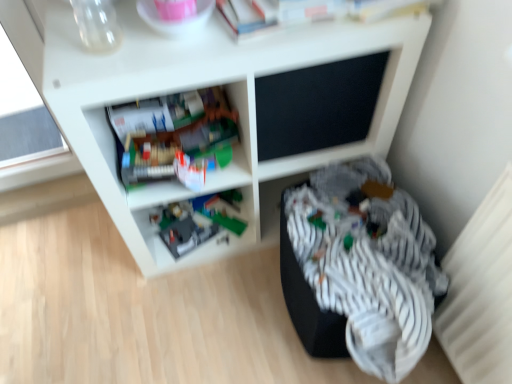
The height and width of the screenshot is (384, 512). What do you see at coordinates (367, 264) in the screenshot?
I see `striped fabric at lower right` at bounding box center [367, 264].

Find the location of a particular element. The image size is (512, 384). plastic gray toy at lower center, the 2th shelf from the front is located at coordinates (199, 226).

From a real-world perspective, is striped fabric at lower right above or below white matte shelf at center, which appears as the second shelf when viewed from the back?

striped fabric at lower right is below white matte shelf at center, which appears as the second shelf when viewed from the back.

Is striped fabric at lower right spatially inside white matte shelf at center, which appears as the second shelf when viewed from the back, or outside of it?

striped fabric at lower right is located beyond the bounds of white matte shelf at center, which appears as the second shelf when viewed from the back.

Is striped fabric at lower right positioned far away from white matte shelf at center, arranged as the 1th shelf when viewed from the front?

That's not correct — striped fabric at lower right is a little close to white matte shelf at center, arranged as the 1th shelf when viewed from the front.

Considering the relative sizes of striped fabric at lower right and white matte shelf at center, which appears as the second shelf when viewed from the back, in the image provided, is striped fabric at lower right wider than white matte shelf at center, which appears as the second shelf when viewed from the back,?

Indeed, striped fabric at lower right has a greater width compared to white matte shelf at center, which appears as the second shelf when viewed from the back.

Does point (398, 34) come in front of point (200, 219)?

Yes.

Could you tell me if white matte shelf at center, arranged as the 1th shelf when viewed from the front, is turned towards plastic gray toy at lower center, the 2th shelf from the front?

No.

How many degrees apart are the facing directions of white matte shelf at center, arranged as the 1th shelf when viewed from the front, and plastic gray toy at lower center, the 2th shelf from the front?

21.5 degrees.

Would you consider white matte shelf at center, arranged as the 1th shelf when viewed from the front, to be distant from plastic gray toy at lower center, positioned as the first shelf in back-to-front order?

No, there isn't a large distance between white matte shelf at center, arranged as the 1th shelf when viewed from the front, and plastic gray toy at lower center, positioned as the first shelf in back-to-front order.

Considering the sizes of striped fabric at lower right and plastic gray toy at lower center, positioned as the first shelf in back-to-front order, in the image, is striped fabric at lower right wider or thinner than plastic gray toy at lower center, positioned as the first shelf in back-to-front order,?

striped fabric at lower right is wider than plastic gray toy at lower center, positioned as the first shelf in back-to-front order.

Can we say striped fabric at lower right lies outside plastic gray toy at lower center, positioned as the first shelf in back-to-front order?

Yes, striped fabric at lower right is not within plastic gray toy at lower center, positioned as the first shelf in back-to-front order.

From a real-world perspective, between striped fabric at lower right and plastic gray toy at lower center, positioned as the first shelf in back-to-front order, who is vertically lower?

plastic gray toy at lower center, positioned as the first shelf in back-to-front order, is physically lower.

From a real-world perspective, is plastic gray toy at lower center, the 2th shelf from the front, on white matte shelf at center, arranged as the 1th shelf when viewed from the front?

No, from a real-world perspective, plastic gray toy at lower center, the 2th shelf from the front, is not above white matte shelf at center, arranged as the 1th shelf when viewed from the front.

From the image's perspective, does plastic gray toy at lower center, positioned as the first shelf in back-to-front order, appear higher than white matte shelf at center, which appears as the second shelf when viewed from the back?

Incorrect, from the image's perspective, plastic gray toy at lower center, positioned as the first shelf in back-to-front order, is lower than white matte shelf at center, which appears as the second shelf when viewed from the back.

Does point (210, 214) lie behind point (393, 40)?

That is True.

Find the location of `clothing that is below the plastic gray toy at lower center, positioned as the first shelf in back-to-front order (from the image's perspective)`. clothing that is below the plastic gray toy at lower center, positioned as the first shelf in back-to-front order (from the image's perspective) is located at coordinates (367, 264).

Does point (223, 200) come behind point (392, 353)?

Yes.

Is plastic gray toy at lower center, positioned as the first shelf in back-to-front order, next to striped fabric at lower right and touching it?

No, plastic gray toy at lower center, positioned as the first shelf in back-to-front order, is not making contact with striped fabric at lower right.

Consider the image. Are white matte shelf at center, which appears as the second shelf when viewed from the back, and striped fabric at lower right located far from each other?

That's not correct — white matte shelf at center, which appears as the second shelf when viewed from the back, is a little close to striped fabric at lower right.

From the picture: From a real-world perspective, is white matte shelf at center, which appears as the second shelf when viewed from the back, located higher than striped fabric at lower right?

Indeed, from a real-world perspective, white matte shelf at center, which appears as the second shelf when viewed from the back, stands above striped fabric at lower right.

Is white matte shelf at center, which appears as the second shelf when viewed from the back, smaller than striped fabric at lower right?

No, white matte shelf at center, which appears as the second shelf when viewed from the back, is not smaller than striped fabric at lower right.

Considering the relative positions of white matte shelf at center, arranged as the 1th shelf when viewed from the front, and striped fabric at lower right in the image provided, is white matte shelf at center, arranged as the 1th shelf when viewed from the front, to the right of striped fabric at lower right from the viewer's perspective?

Incorrect, white matte shelf at center, arranged as the 1th shelf when viewed from the front, is not on the right side of striped fabric at lower right.

Which shelf is the 1st one when counting from the left side of the striped fabric at lower right? Please provide its 2D coordinates.

[(228, 99)]

Where is `shelf on the right of plastic gray toy at lower center, the 2th shelf from the front`? The width and height of the screenshot is (512, 384). shelf on the right of plastic gray toy at lower center, the 2th shelf from the front is located at coordinates (228, 99).

Considering their positions, is striped fabric at lower right positioned closer to white matte shelf at center, arranged as the 1th shelf when viewed from the front, than plastic gray toy at lower center, positioned as the first shelf in back-to-front order?

Among the two, plastic gray toy at lower center, positioned as the first shelf in back-to-front order, is located nearer to white matte shelf at center, arranged as the 1th shelf when viewed from the front.

Estimate the real-world distances between objects in this image. Which object is further from striped fabric at lower right, white matte shelf at center, which appears as the second shelf when viewed from the back, or plastic gray toy at lower center, positioned as the first shelf in back-to-front order?

plastic gray toy at lower center, positioned as the first shelf in back-to-front order, is further to striped fabric at lower right.

Estimate the real-world distances between objects in this image. Which object is further from striped fabric at lower right, plastic gray toy at lower center, the 2th shelf from the front, or white matte shelf at center, which appears as the second shelf when viewed from the back?

plastic gray toy at lower center, the 2th shelf from the front, is further to striped fabric at lower right.

Which object lies nearer to the anchor point plastic gray toy at lower center, the 2th shelf from the front, striped fabric at lower right or white matte shelf at center, arranged as the 1th shelf when viewed from the front?

Based on the image, white matte shelf at center, arranged as the 1th shelf when viewed from the front, appears to be nearer to plastic gray toy at lower center, the 2th shelf from the front.

From the image, which object appears to be nearer to plastic gray toy at lower center, the 2th shelf from the front, white matte shelf at center, arranged as the 1th shelf when viewed from the front, or striped fabric at lower right?

white matte shelf at center, arranged as the 1th shelf when viewed from the front, is closer to plastic gray toy at lower center, the 2th shelf from the front.

Which object lies further to the anchor point white matte shelf at center, which appears as the second shelf when viewed from the back, plastic gray toy at lower center, the 2th shelf from the front, or striped fabric at lower right?

striped fabric at lower right is positioned further to the anchor white matte shelf at center, which appears as the second shelf when viewed from the back.

This screenshot has width=512, height=384. I want to click on clothing positioned between white matte shelf at center, which appears as the second shelf when viewed from the back, and plastic gray toy at lower center, the 2th shelf from the front, from near to far, so click(x=367, y=264).